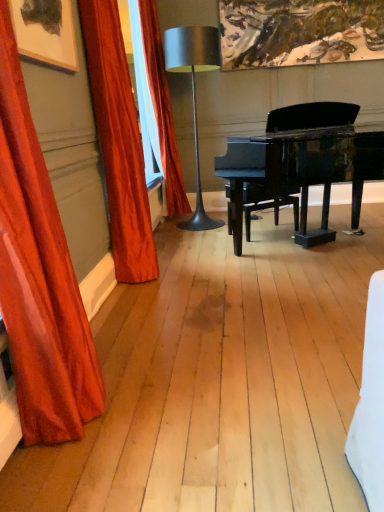
Question: Could you tell me if black polished piano at center is turned towards satin red curtain at left, acting as the 2th curtain starting from the front?

Choices:
 (A) yes
 (B) no

Answer: (B)

Question: Is black polished piano at center smaller than satin red curtain at left, arranged as the second curtain when viewed from the back?

Choices:
 (A) no
 (B) yes

Answer: (A)

Question: Is black polished piano at center to the left of satin red curtain at left, acting as the 2th curtain starting from the front, from the viewer's perspective?

Choices:
 (A) yes
 (B) no

Answer: (B)

Question: Considering the relative sizes of black polished piano at center and satin red curtain at left, acting as the 2th curtain starting from the front, in the image provided, is black polished piano at center shorter than satin red curtain at left, acting as the 2th curtain starting from the front,?

Choices:
 (A) no
 (B) yes

Answer: (B)

Question: Considering the relative sizes of black polished piano at center and satin red curtain at left, arranged as the second curtain when viewed from the back, in the image provided, is black polished piano at center taller than satin red curtain at left, arranged as the second curtain when viewed from the back,?

Choices:
 (A) no
 (B) yes

Answer: (A)

Question: Is satin red curtain at left, acting as the 1th curtain starting from the front, to the left or to the right of satin orange curtain at left, the 1th curtain viewed from the back, in the image?

Choices:
 (A) left
 (B) right

Answer: (A)

Question: From the image's perspective, is satin red curtain at left, acting as the 1th curtain starting from the front, above or below satin orange curtain at left, the 1th curtain viewed from the back?

Choices:
 (A) above
 (B) below

Answer: (B)

Question: Considering the positions of satin red curtain at left, acting as the 1th curtain starting from the front, and satin orange curtain at left, the 1th curtain viewed from the back, in the image, is satin red curtain at left, acting as the 1th curtain starting from the front, taller or shorter than satin orange curtain at left, the 1th curtain viewed from the back,?

Choices:
 (A) tall
 (B) short

Answer: (B)

Question: Looking at their shapes, would you say satin red curtain at left, the third curtain from the back, is wider or thinner than satin orange curtain at left, placed as the 3th curtain when sorted from front to back?

Choices:
 (A) thin
 (B) wide

Answer: (A)

Question: Looking at their shapes, would you say metallic silver table lamp at center is wider or thinner than satin red curtain at left, arranged as the second curtain when viewed from the back?

Choices:
 (A) wide
 (B) thin

Answer: (A)

Question: From the image's perspective, relative to satin red curtain at left, acting as the 2th curtain starting from the front, is metallic silver table lamp at center above or below?

Choices:
 (A) above
 (B) below

Answer: (A)

Question: Based on their positions, is metallic silver table lamp at center located to the left or right of satin red curtain at left, arranged as the second curtain when viewed from the back?

Choices:
 (A) right
 (B) left

Answer: (A)

Question: Do you think metallic silver table lamp at center is within satin red curtain at left, acting as the 2th curtain starting from the front, or outside of it?

Choices:
 (A) outside
 (B) inside

Answer: (A)

Question: In terms of height, does satin red curtain at left, acting as the 2th curtain starting from the front, look taller or shorter compared to metallic silver table lamp at center?

Choices:
 (A) short
 (B) tall

Answer: (B)

Question: Visually, is satin red curtain at left, acting as the 2th curtain starting from the front, positioned to the left or to the right of metallic silver table lamp at center?

Choices:
 (A) right
 (B) left

Answer: (B)